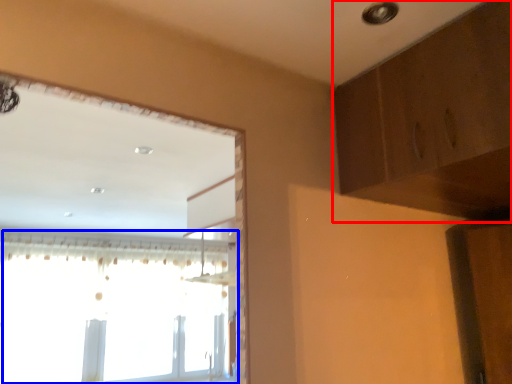
Question: Which of the following is the closest to the observer, dresser (highlighted by a red box) or window (highlighted by a blue box)?

Choices:
 (A) dresser
 (B) window

Answer: (A)